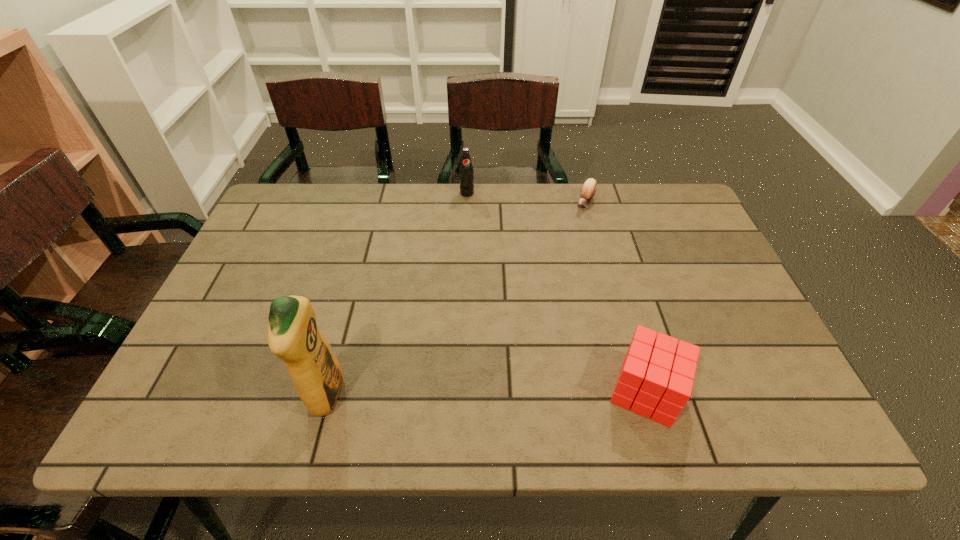
Image resolution: width=960 pixels, height=540 pixels. What are the coordinates of `detergent` in the screenshot? It's located at click(x=293, y=336).

Where is `the leftmost object`? the leftmost object is located at coordinates (293, 336).

Identify the location of the third tallest object. (656, 377).

Find the location of a particular element. the shortest object is located at coordinates (589, 188).

I want to click on pop, so click(466, 172).

Identify the location of the second object from left to right. Image resolution: width=960 pixels, height=540 pixels. (466, 172).

You are a GUI agent. You are given a task and a screenshot of the screen. Output one action in this format:
    pyautogui.click(x=<x>, y=<y>)
    Task: Click on the vacant space situated on the right of the third tallest object
    Image resolution: width=960 pixels, height=540 pixels.
    Given the screenshot: What is the action you would take?
    pyautogui.click(x=761, y=391)

Where is `vacant space located on the front-facing side of the escargot`? This screenshot has width=960, height=540. vacant space located on the front-facing side of the escargot is located at coordinates (557, 249).

You are a GUI agent. You are given a task and a screenshot of the screen. Output one action in this format:
    pyautogui.click(x=<x>, y=<y>)
    Task: Click on the blank space located 0.330m on the front-facing side of the escargot
    
    Given the screenshot: What is the action you would take?
    pyautogui.click(x=537, y=282)

At what (x,y) coordinates should I click in order to perform the action: click on free location located on the front-facing side of the escargot. Please return your answer as a coordinate pair (x, y). Looking at the image, I should click on (540, 277).